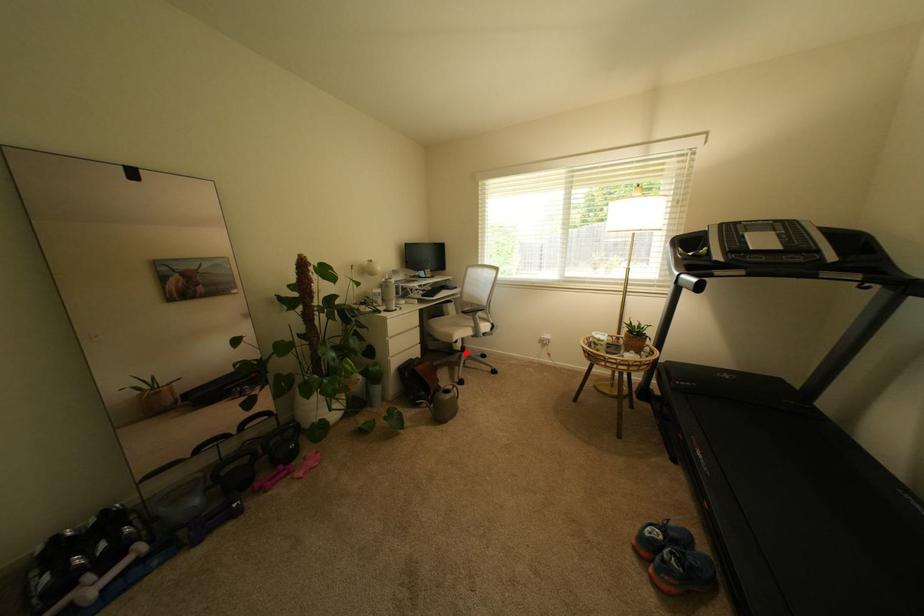
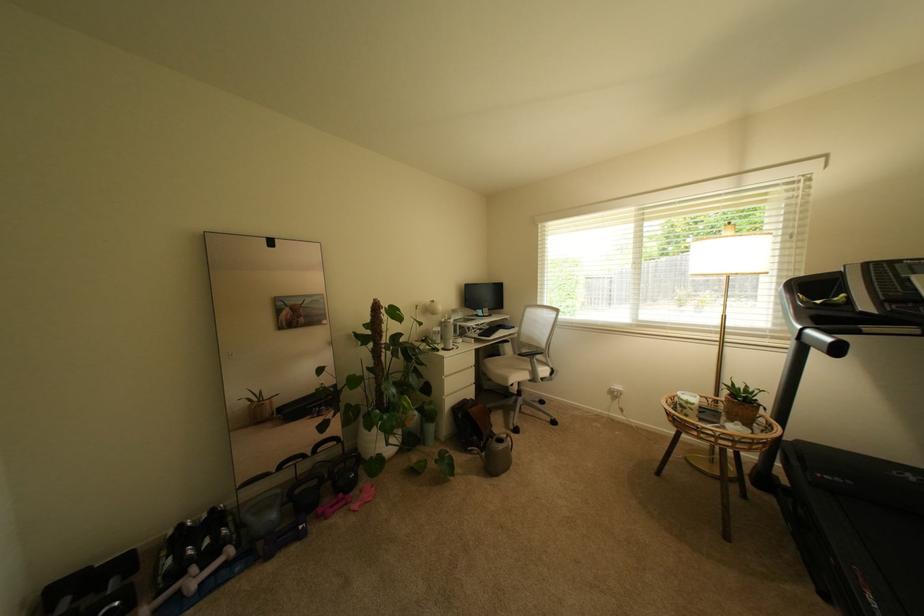
The point at the highlighted location is marked in the first image. Where is the corresponding point in the second image?

(521, 395)